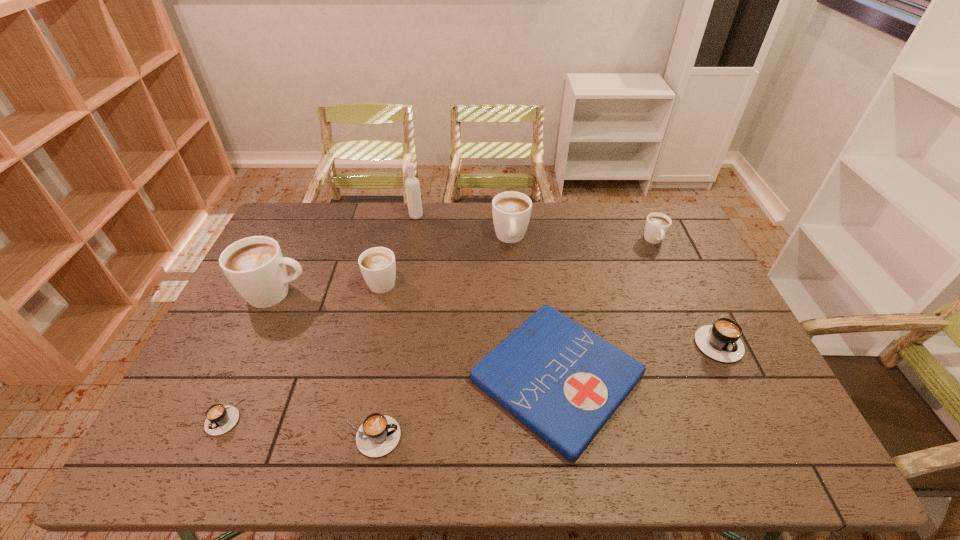
Where is `vacant space that satisfies the following two spatial constraints: 1. with the handle on the side of the seventh shortest object; 2. on the right side of the first-aid kit`? vacant space that satisfies the following two spatial constraints: 1. with the handle on the side of the seventh shortest object; 2. on the right side of the first-aid kit is located at coordinates (521, 377).